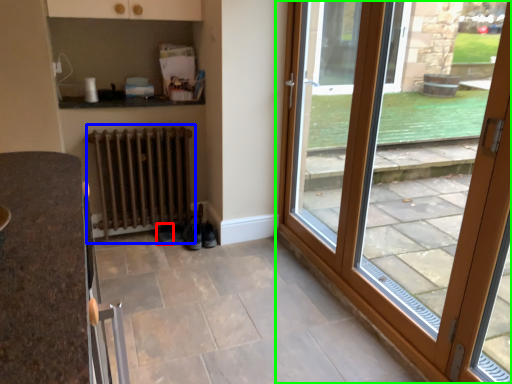
Question: Estimate the real-world distances between objects in this image. Which object is farther from shoe (highlighted by a red box), radiator (highlighted by a blue box) or door (highlighted by a green box)?

Choices:
 (A) radiator
 (B) door

Answer: (B)